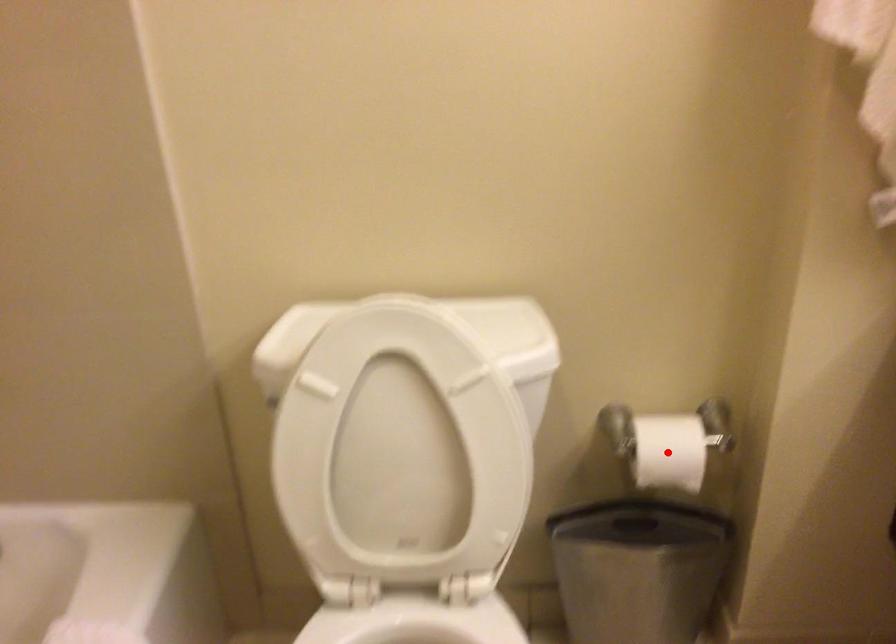
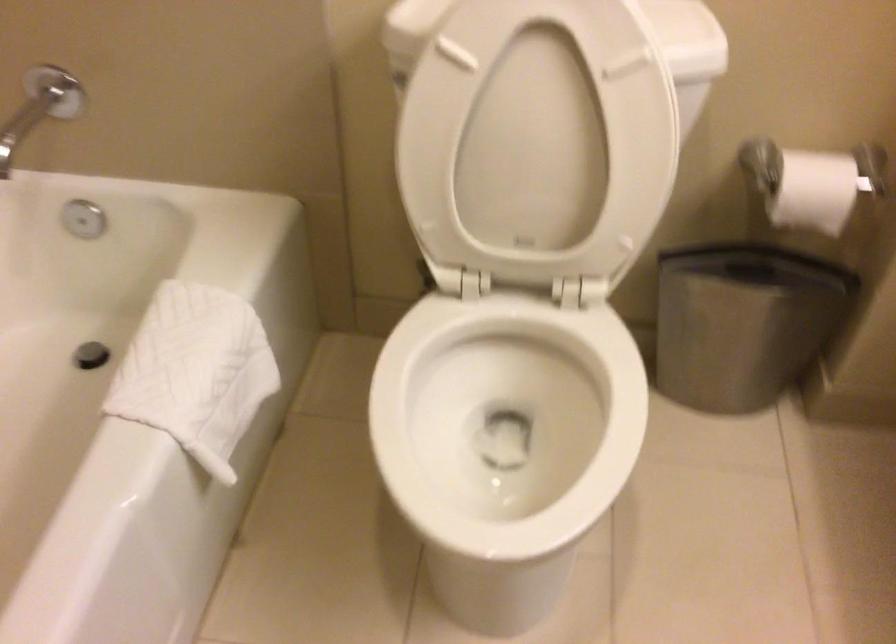
In the second image, find the point that corresponds to the highlighted location in the first image.

(812, 183)